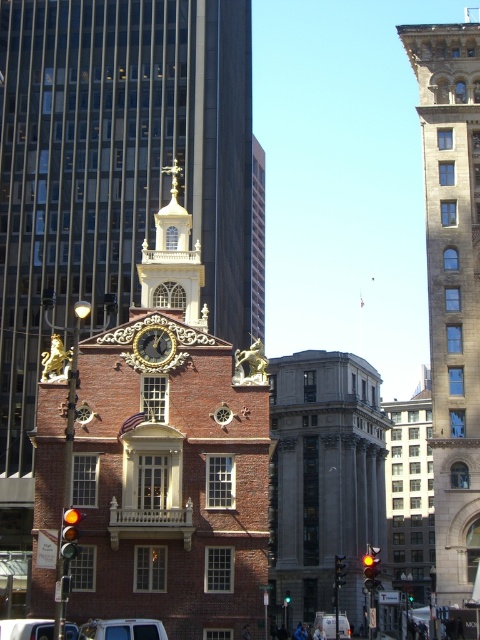
Question: Observing the image, what is the correct spatial positioning of gray stone building at center in reference to white matte van at lower left?

Choices:
 (A) right
 (B) left

Answer: (A)

Question: Which point appears closest to the camera in this image?

Choices:
 (A) (446, 435)
 (B) (322, 364)
 (C) (160, 227)
 (D) (170, 355)

Answer: (D)

Question: Does gray stone building at center appear over gold metallic clock at center?

Choices:
 (A) yes
 (B) no

Answer: (B)

Question: Considering the real-world distances, which object is closest to the white matte van at lower left?

Choices:
 (A) gray stone building at center
 (B) metallic silver van at lower center
 (C) white matte van at center
 (D) gold polished metal spire at center

Answer: (B)

Question: Which object appears farthest from the camera in this image?

Choices:
 (A) brick tower at center
 (B) stone tower at right

Answer: (B)

Question: Does brick tower at center lie behind stone tower at right?

Choices:
 (A) yes
 (B) no

Answer: (B)